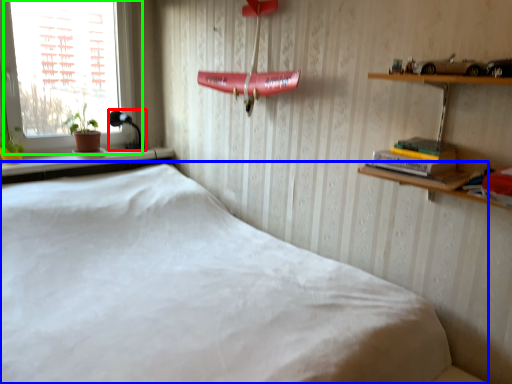
Question: Based on their relative distances, which object is nearer to lamp (highlighted by a red box)? Choose from bed (highlighted by a blue box) and window (highlighted by a green box).

Choices:
 (A) bed
 (B) window

Answer: (B)